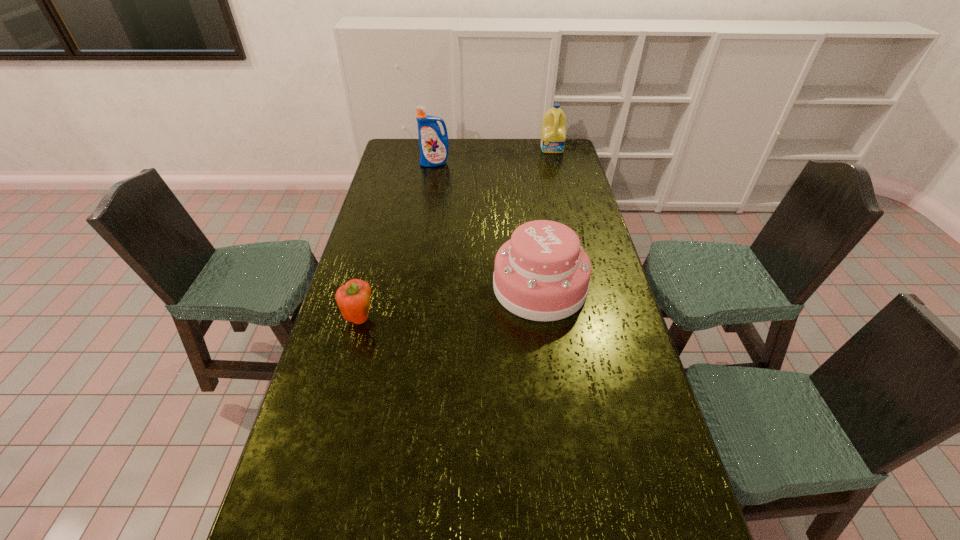
The height and width of the screenshot is (540, 960). Identify the location of the left detergent. (434, 147).

The height and width of the screenshot is (540, 960). Find the location of `the third object from right to left`. the third object from right to left is located at coordinates (434, 147).

What are the coordinates of `the farther detergent` in the screenshot? It's located at (553, 132).

Locate an element on the screen. The height and width of the screenshot is (540, 960). the farthest object is located at coordinates (553, 132).

Locate an element on the screen. This screenshot has height=540, width=960. cake is located at coordinates [542, 273].

Where is `the shortest object`? The image size is (960, 540). the shortest object is located at coordinates [354, 298].

The height and width of the screenshot is (540, 960). I want to click on pepper, so click(x=354, y=298).

This screenshot has width=960, height=540. In order to click on vacant space situated 0.310m on the label of the third nearest object in this screenshot , I will do `click(429, 204)`.

I want to click on free region located on the label of the farther detergent, so click(x=561, y=180).

Identify the location of vacant position located on the back of the cake. The width and height of the screenshot is (960, 540). (528, 201).